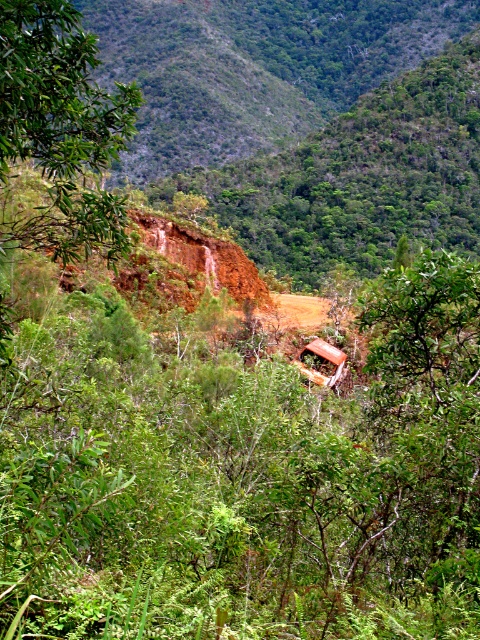
You are a hiker trying to estimate the space between two landmarks in this rugged landscape. You see a green leafy tree at left and a rusty metal jeep at center. Which object takes up more horizontal space in the image?

The green leafy tree at left takes up more horizontal space than the rusty metal jeep at center because its width is larger according to the description.

You are a hiker trying to navigate through the rugged landscape. You need to determine if the green leafy tree at left can provide shade over the rusty metal jeep at center. Can it? Please explain your reasoning based on their sizes and positions.

The green leafy tree at left is taller than the rusty metal jeep at center, so it is possible that the tree could provide shade over the rusty metal jeep at center depending on the time of day and the angle of the sun.

You are a photographer standing at the edge of the cliff, and you want to capture both the abandoned vehicle and the patch of bare soil in your shot. Which of the two points, point [107,248] or point [307,371], is closer to your current position?

Point [107,248] is closer to the camera than point [307,371], so it is closer to your current position.